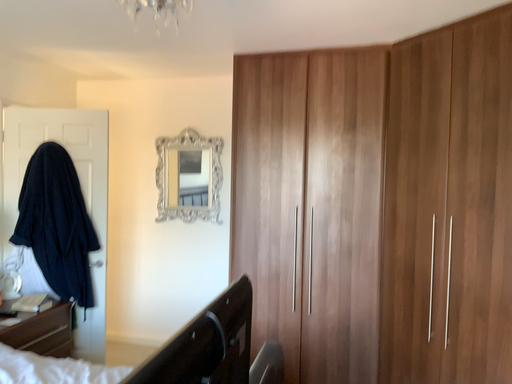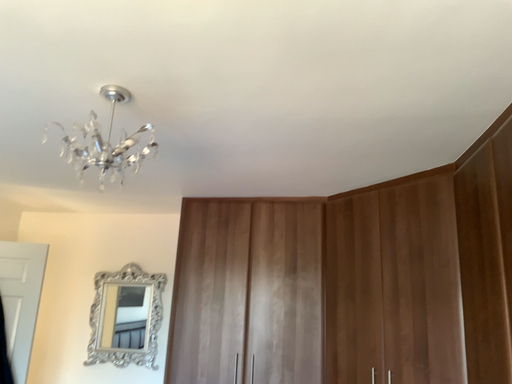
Question: Which way did the camera rotate in the video?

Choices:
 (A) rotated downward
 (B) rotated upward

Answer: (B)